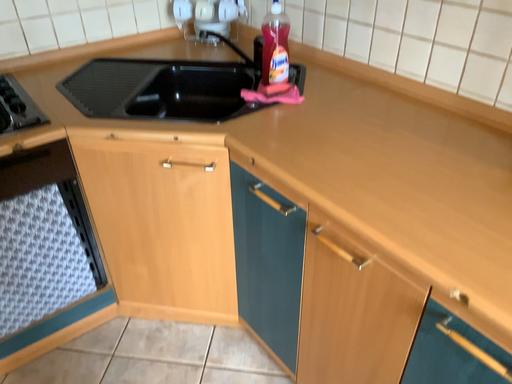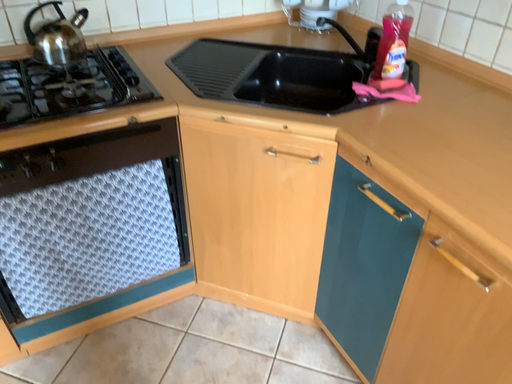
Question: Which way did the camera rotate in the video?

Choices:
 (A) rotated left
 (B) rotated right

Answer: (A)